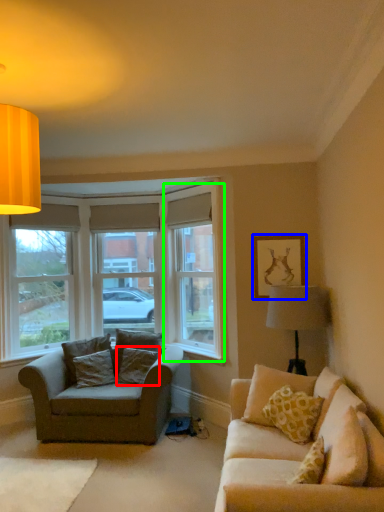
Question: Based on their relative distances, which object is farther from pillow (highlighted by a red box)? Choose from picture frame (highlighted by a blue box) and window screen (highlighted by a green box).

Choices:
 (A) picture frame
 (B) window screen

Answer: (A)